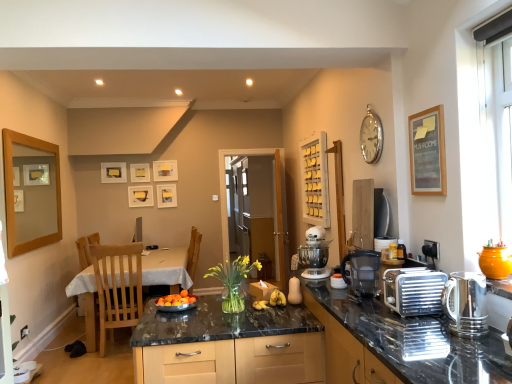
Locate an element on the screen. metallic gold picture frame at upper center, the third picture frame when ordered from front to back is located at coordinates (113, 172).

You are a GUI agent. You are given a task and a screenshot of the screen. Output one action in this format:
    pyautogui.click(x=<x>, y=<y>)
    Task: Click on the white matte mixer at center
    The height and width of the screenshot is (384, 512).
    Given the screenshot: What is the action you would take?
    pyautogui.click(x=315, y=254)

Locate an element on the screen. The image size is (512, 384). matte yellow picture frame at upper center, the fourth picture frame from the front is located at coordinates (140, 196).

Locate an element on the screen. This screenshot has width=512, height=384. black plastic water filter at center, acting as the 1th kitchen appliance starting from the back is located at coordinates (362, 271).

The height and width of the screenshot is (384, 512). What do you see at coordinates (466, 304) in the screenshot? I see `sleek metallic kettle at right, acting as the second kitchen appliance starting from the back` at bounding box center [466, 304].

You are a GUI agent. You are given a task and a screenshot of the screen. Output one action in this format:
    pyautogui.click(x=<x>, y=<y>)
    Task: Click on the white matte picture frame at upper center, acting as the 6th picture frame starting from the front
    This screenshot has width=512, height=384.
    Given the screenshot: What is the action you would take?
    pyautogui.click(x=165, y=170)

The image size is (512, 384). I want to click on light wood chair at left, the first chair when ordered from front to back, so click(117, 286).

Is point (157, 262) in front of point (367, 144)?

No, (157, 262) is behind (367, 144).

Considering the relative sizes of white glossy table at lower left and silver metallic clock at upper right in the image provided, is white glossy table at lower left shorter than silver metallic clock at upper right?

No.

From the image's perspective, which is above, white glossy table at lower left or silver metallic clock at upper right?

From the image's view, silver metallic clock at upper right is above.

Can we say black marble countertop at center lies outside silver metallic clock at upper right?

Yes.

From the image's perspective, is black marble countertop at center above silver metallic clock at upper right?

No, from the image's perspective, black marble countertop at center is not above silver metallic clock at upper right.

Which of these two, black marble countertop at center or silver metallic clock at upper right, is thinner?

silver metallic clock at upper right is thinner.

Considering the sizes of objects black marble countertop at center and silver metallic clock at upper right in the image provided, who is taller, black marble countertop at center or silver metallic clock at upper right?

Standing taller between the two is black marble countertop at center.

Identify the location of fruit located in front of the white matte picture frame at upper center, arranged as the second picture frame when viewed from the back. (177, 299).

Looking at their sizes, would you say metallic silver bowl at center is wider or thinner than white matte picture frame at upper center, the 5th picture frame positioned from the left?

In the image, metallic silver bowl at center appears to be wider than white matte picture frame at upper center, the 5th picture frame positioned from the left.

Is point (176, 304) closer to viewer compared to point (156, 180)?

That is True.

Considering the sizes of objects metallic silver bowl at center and white matte picture frame at upper center, the 5th picture frame positioned from the left, in the image provided, who is taller, metallic silver bowl at center or white matte picture frame at upper center, the 5th picture frame positioned from the left,?

white matte picture frame at upper center, the 5th picture frame positioned from the left, is taller.

From the image's perspective, is black marble countertop at center located above silver metallic toaster at right, which is the second appliance in front-to-back order?

Incorrect, from the image's perspective, black marble countertop at center is lower than silver metallic toaster at right, which is the second appliance in front-to-back order.

Is black marble countertop at center completely or partially outside of silver metallic toaster at right, positioned as the 1th appliance in bottom-to-top order?

Yes, black marble countertop at center is outside of silver metallic toaster at right, positioned as the 1th appliance in bottom-to-top order.

Which object is thinner, black marble countertop at center or silver metallic toaster at right, which is the second appliance in front-to-back order?

Thinner between the two is silver metallic toaster at right, which is the second appliance in front-to-back order.

Between black marble countertop at center and silver metallic toaster at right, marked as the 2th appliance in a top-to-bottom arrangement, which one appears on the left side from the viewer's perspective?

From the viewer's perspective, black marble countertop at center appears more on the left side.

In order to click on cabinetry that is in front of the wooden chair at left, arranged as the 2th chair when viewed from the front in this screenshot , I will do `click(221, 340)`.

Does black marble countertop at center have a lesser height compared to wooden chair at left, arranged as the 2th chair when viewed from the front?

Correct, black marble countertop at center is not as tall as wooden chair at left, arranged as the 2th chair when viewed from the front.

Which point is more forward, (x=145, y=377) or (x=189, y=288)?

Point (x=145, y=377)

Can you confirm if black marble countertop at center is wider than wooden chair at left, which is the first chair from back to front?

Yes.

Considering the positions of objects wooden chair at left, arranged as the 2th chair when viewed from the front, and matte white picture frame at upper center, arranged as the 5th picture frame when viewed from the right, in the image provided, who is more to the left, wooden chair at left, arranged as the 2th chair when viewed from the front, or matte white picture frame at upper center, arranged as the 5th picture frame when viewed from the right,?

matte white picture frame at upper center, arranged as the 5th picture frame when viewed from the right.

From a real-world perspective, is wooden chair at left, arranged as the 2th chair when viewed from the front, beneath matte white picture frame at upper center, the third picture frame from the left?

Yes.

Locate an element on the screen. The image size is (512, 384). the 5th picture frame above when counting from the wooden chair at left, which is the first chair from back to front (from the image's perspective) is located at coordinates (140, 172).

Is wooden chair at left, arranged as the 2th chair when viewed from the front, facing away from matte white picture frame at upper center, which appears as the 3th picture frame when viewed from the back?

wooden chair at left, arranged as the 2th chair when viewed from the front, does not have its back to matte white picture frame at upper center, which appears as the 3th picture frame when viewed from the back.

Considering the sizes of objects silver metallic toaster at right, the first appliance in the back-to-front sequence, and white glossy table at lower left in the image provided, who is taller, silver metallic toaster at right, the first appliance in the back-to-front sequence, or white glossy table at lower left?

Standing taller between the two is white glossy table at lower left.

Based on the photo, does silver metallic toaster at right, marked as the 2th appliance in a top-to-bottom arrangement, have a lesser width compared to white glossy table at lower left?

Correct, the width of silver metallic toaster at right, marked as the 2th appliance in a top-to-bottom arrangement, is less than that of white glossy table at lower left.

Find the location of a particular element. table that is behind the silver metallic clock at upper right is located at coordinates (167, 266).

The height and width of the screenshot is (384, 512). In the image, there is a black marble countertop at center. Find the location of `clock above it (from the image's perspective)`. clock above it (from the image's perspective) is located at coordinates (371, 137).

Estimate the real-world distances between objects in this image. Which object is closer to metallic silver bowl at center, white matte mixer at center or wooden picture frame at left, positioned as the 6th picture frame in back-to-front order?

white matte mixer at center.

Based on their spatial positions, is orange ceramic pot at right, which is the second appliance from left to right, or metallic gold picture frame at upper center, the third picture frame when ordered from front to back, closer to wooden chair at left, arranged as the 2th chair when viewed from the front?

metallic gold picture frame at upper center, the third picture frame when ordered from front to back, is closer to wooden chair at left, arranged as the 2th chair when viewed from the front.

Based on their spatial positions, is white matte mixer at center or wooden picture frame at left, positioned as the 6th picture frame in back-to-front order, closer to wooden framed poster at right, the 1th picture frame positioned from the right?

The object closer to wooden framed poster at right, the 1th picture frame positioned from the right, is white matte mixer at center.

From the image, which object appears to be nearer to silver metallic toaster at right, the second appliance from the right, matte yellow picture frame at upper center, which is the 4th picture frame in left-to-right order, or matte white picture frame at center, the 1th picture frame viewed from the back?

The object closer to silver metallic toaster at right, the second appliance from the right, is matte white picture frame at center, the 1th picture frame viewed from the back.

Based on their spatial positions, is sleek metallic kettle at right, the second kitchen appliance from the left, or wooden framed poster at right, the 1th picture frame positioned from the right, closer to wooden picture frame at left, the second picture frame from the front?

wooden framed poster at right, the 1th picture frame positioned from the right, is closer to wooden picture frame at left, the second picture frame from the front.

Estimate the real-world distances between objects in this image. Which object is further from white matte picture frame at upper center, acting as the 6th picture frame starting from the front, wooden picture frame at left, which ranks as the seventh picture frame in right-to-left order, or metallic gold picture frame at upper center, the 6th picture frame when ordered from right to left?

Among the two, wooden picture frame at left, which ranks as the seventh picture frame in right-to-left order, is located further to white matte picture frame at upper center, acting as the 6th picture frame starting from the front.

Considering their positions, is matte white picture frame at center, positioned as the second picture frame in right-to-left order, positioned closer to shiny granite countertop at center than matte white picture frame at upper center, arranged as the 5th picture frame when viewed from the right?

The object closer to shiny granite countertop at center is matte white picture frame at center, positioned as the second picture frame in right-to-left order.

From the image, which object appears to be nearer to orange ceramic pot at right, the 1th appliance from the right, matte white picture frame at center, positioned as the second picture frame in right-to-left order, or black marble countertop at center?

Based on the image, black marble countertop at center appears to be nearer to orange ceramic pot at right, the 1th appliance from the right.

This screenshot has height=384, width=512. In order to click on mixer between wooden framed poster at right, the seventh picture frame from the left, and metallic gold picture frame at upper center, which ranks as the 5th picture frame in back-to-front order, along the z-axis in this screenshot , I will do `click(315, 254)`.

I want to click on mixer located between black marble countertop at center and matte white picture frame at upper center, which appears as the fifth picture frame when viewed from the front, in the depth direction, so point(315,254).

Identify the location of picture frame located between metallic silver bowl at center and metallic gold picture frame at upper center, the 6th picture frame when ordered from right to left, in the depth direction. Image resolution: width=512 pixels, height=384 pixels. (31, 193).

Where is `fruit positioned between black marble countertop at center and metallic gold picture frame at upper center, which ranks as the 5th picture frame in back-to-front order, from near to far`? This screenshot has width=512, height=384. fruit positioned between black marble countertop at center and metallic gold picture frame at upper center, which ranks as the 5th picture frame in back-to-front order, from near to far is located at coordinates (177, 299).